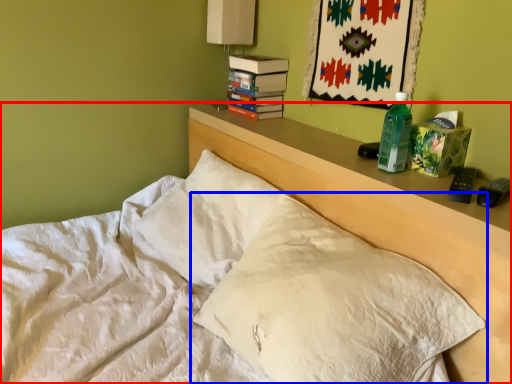
Question: Which object is further to the camera taking this photo, bed (highlighted by a red box) or pillow (highlighted by a blue box)?

Choices:
 (A) bed
 (B) pillow

Answer: (B)